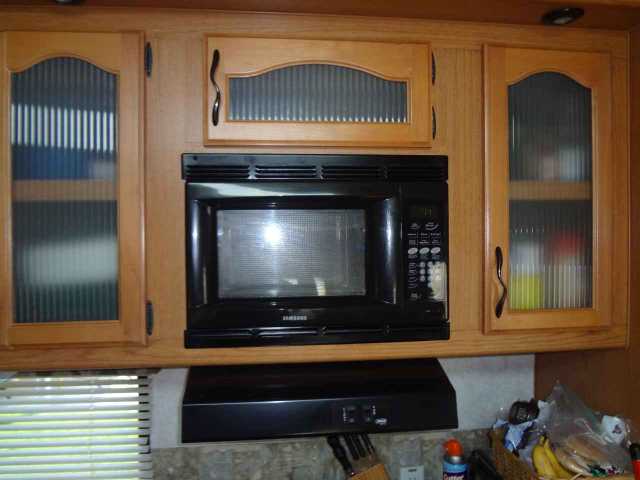
Where is `1 brown basket`? 1 brown basket is located at coordinates (509, 463).